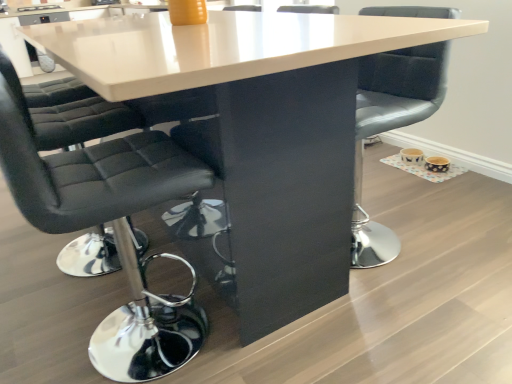
Find the location of a particular element. vacant space underneath black leather chair at left, the first chair when ordered from left to right (from a real-world perspective) is located at coordinates click(102, 354).